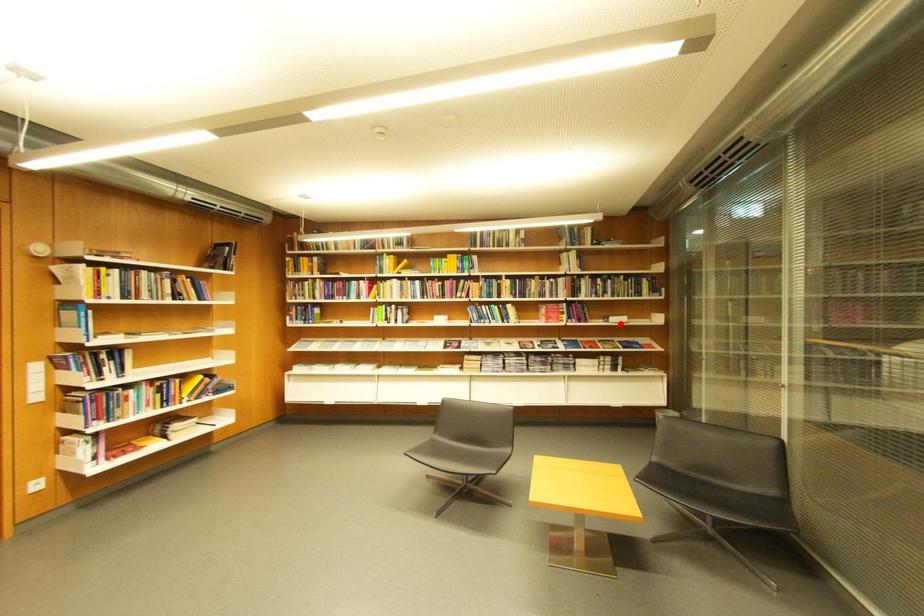
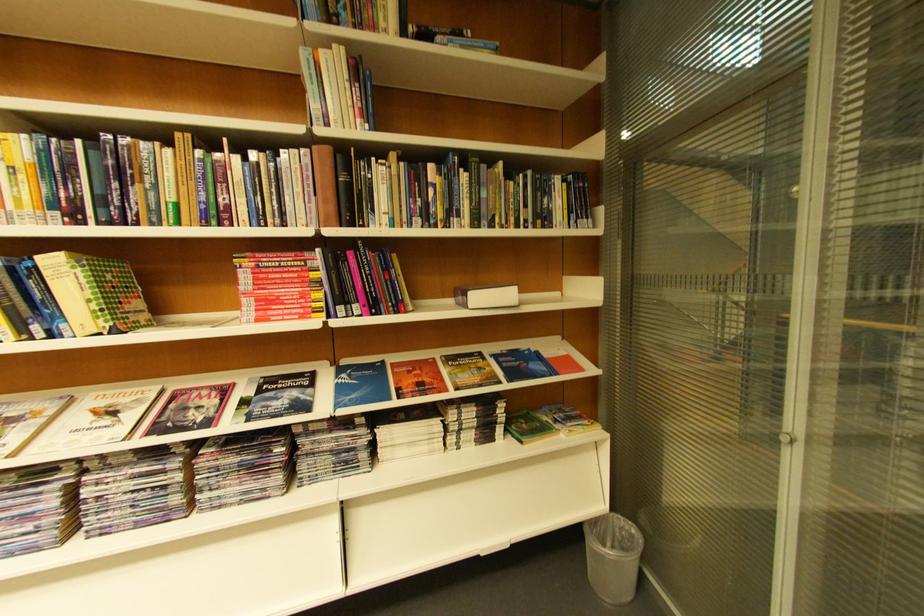
Locate, in the second image, the point that corresponds to the highlighted location in the first image.

(480, 309)